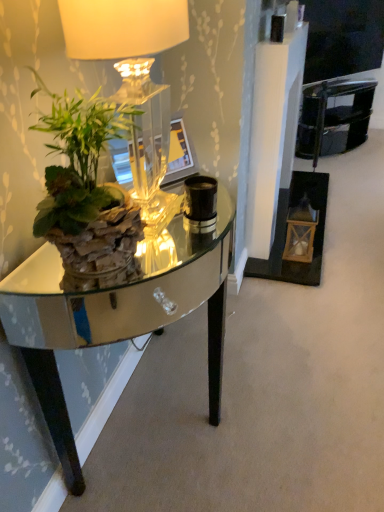
In order to face clear glass table at left, should I rotate leftwards or rightwards?

You should look left and rotate roughly 1.507 degrees.

I want to click on clear glass table at left, so click(117, 313).

The height and width of the screenshot is (512, 384). What do you see at coordinates (334, 118) in the screenshot?
I see `black glossy armchair at upper right` at bounding box center [334, 118].

In order to click on green leafy plant at left in this screenshot , I will do [86, 193].

Looking at their sizes, would you say matte glass lamp at upper left is wider or thinner than green leafy plant at left?

In the image, matte glass lamp at upper left appears to be wider than green leafy plant at left.

Is matte glass lamp at upper left not close to green leafy plant at left?

No, matte glass lamp at upper left is not far away from green leafy plant at left.

Looking at this image, is matte glass lamp at upper left inside or outside of green leafy plant at left?

matte glass lamp at upper left is not inside green leafy plant at left, it's outside.

Between matte glass lamp at upper left and green leafy plant at left, which one appears on the right side from the viewer's perspective?

Positioned to the right is matte glass lamp at upper left.

Is green leafy plant at left positioned with its back to clear glass table at left?

No, green leafy plant at left is not facing the opposite direction of clear glass table at left.

In the scene shown: Is green leafy plant at left smaller than clear glass table at left?

Yes.

Considering the positions of objects green leafy plant at left and clear glass table at left in the image provided, who is behind, green leafy plant at left or clear glass table at left?

clear glass table at left is more distant.

From the image's perspective, is matte glass lamp at upper left located beneath clear glass table at left?

No, from the image's perspective, matte glass lamp at upper left is not below clear glass table at left.

Could you tell me if matte glass lamp at upper left is facing clear glass table at left?

No.

Is matte glass lamp at upper left to the right of clear glass table at left from the viewer's perspective?

No.

How many degrees apart are the facing directions of matte glass lamp at upper left and clear glass table at left?

matte glass lamp at upper left and clear glass table at left are facing 2.55 degrees away from each other.

Is black glossy armchair at upper right not close to clear glass table at left?

black glossy armchair at upper right is far away from clear glass table at left.

Looking at this image, which object is thinner, black glossy armchair at upper right or clear glass table at left?

black glossy armchair at upper right.

Considering the sizes of objects black glossy armchair at upper right and clear glass table at left in the image provided, who is taller, black glossy armchair at upper right or clear glass table at left?

With more height is clear glass table at left.

Which of these two, clear glass table at left or green leafy plant at left, is smaller?

With smaller size is green leafy plant at left.

From a real-world perspective, does clear glass table at left stand above green leafy plant at left?

Actually, clear glass table at left is physically below green leafy plant at left in the real world.

Which object is closer to the camera taking this photo, clear glass table at left or green leafy plant at left?

green leafy plant at left is closer to the camera.

Identify the location of houseplant in front of the clear glass table at left. (86, 193).

Between clear glass table at left and black glossy armchair at upper right, which one has less height?

With less height is black glossy armchair at upper right.

From a real-world perspective, between clear glass table at left and black glossy armchair at upper right, who is vertically higher?

From a 3D spatial view, clear glass table at left is above.

Does clear glass table at left turn towards black glossy armchair at upper right?

No, clear glass table at left does not turn towards black glossy armchair at upper right.

How many degrees apart are the facing directions of clear glass table at left and black glossy armchair at upper right?

33.3 degrees.

Which is more to the left, black glossy armchair at upper right or matte glass lamp at upper left?

Positioned to the left is matte glass lamp at upper left.

Is black glossy armchair at upper right spatially inside matte glass lamp at upper left, or outside of it?

black glossy armchair at upper right is located beyond the bounds of matte glass lamp at upper left.

The width and height of the screenshot is (384, 512). I want to click on armchair lying above the matte glass lamp at upper left (from the image's perspective), so pos(334,118).

Locate an element on the screen. Image resolution: width=384 pixels, height=512 pixels. lamp above the green leafy plant at left (from a real-world perspective) is located at coordinates (134, 80).

You are a GUI agent. You are given a task and a screenshot of the screen. Output one action in this format:
    pyautogui.click(x=<x>, y=<y>)
    Task: Click on the houseplant in front of the clear glass table at left
    
    Given the screenshot: What is the action you would take?
    pyautogui.click(x=86, y=193)

Which object lies further to the anchor point black glossy armchair at upper right, matte glass lamp at upper left or clear glass table at left?

The object further to black glossy armchair at upper right is clear glass table at left.

Considering their positions, is matte glass lamp at upper left positioned closer to clear glass table at left than green leafy plant at left?

The object closer to clear glass table at left is green leafy plant at left.

When comparing their distances from clear glass table at left, does matte glass lamp at upper left or black glossy armchair at upper right seem closer?

The object closer to clear glass table at left is matte glass lamp at upper left.

Considering their positions, is green leafy plant at left positioned closer to matte glass lamp at upper left than clear glass table at left?

The object closer to matte glass lamp at upper left is green leafy plant at left.

Based on their spatial positions, is black glossy armchair at upper right or green leafy plant at left further from matte glass lamp at upper left?

black glossy armchair at upper right.

Considering their positions, is clear glass table at left positioned further to matte glass lamp at upper left than black glossy armchair at upper right?

Among the two, black glossy armchair at upper right is located further to matte glass lamp at upper left.

Estimate the real-world distances between objects in this image. Which object is further from green leafy plant at left, matte glass lamp at upper left or black glossy armchair at upper right?

black glossy armchair at upper right is further to green leafy plant at left.

Consider the image. From the image, which object appears to be nearer to black glossy armchair at upper right, green leafy plant at left or clear glass table at left?

clear glass table at left is closer to black glossy armchair at upper right.

The image size is (384, 512). Identify the location of lamp positioned between green leafy plant at left and black glossy armchair at upper right from near to far. (134, 80).

Identify the location of houseplant between matte glass lamp at upper left and clear glass table at left vertically. (86, 193).

Identify the location of desk between matte glass lamp at upper left and black glossy armchair at upper right in the front-back direction. (117, 313).

At what (x,y) coordinates should I click in order to perform the action: click on desk located between green leafy plant at left and black glossy armchair at upper right in the depth direction. Please return your answer as a coordinate pair (x, y). Image resolution: width=384 pixels, height=512 pixels. Looking at the image, I should click on (117, 313).